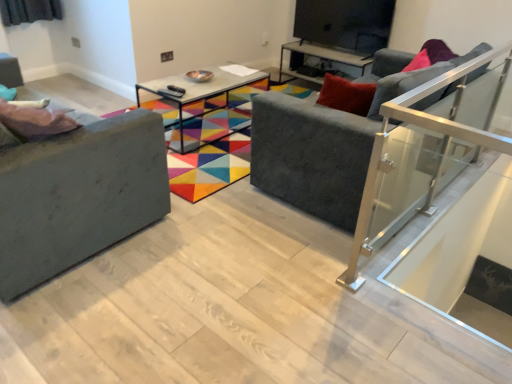
Question: Considering the relative positions of matte gray couch at left, placed as the second studio couch when sorted from right to left, and pink fabric pillow at left in the image provided, is matte gray couch at left, placed as the second studio couch when sorted from right to left, behind pink fabric pillow at left?

Choices:
 (A) yes
 (B) no

Answer: (B)

Question: Could you tell me if matte gray couch at left, placed as the second studio couch when sorted from right to left, is facing pink fabric pillow at left?

Choices:
 (A) no
 (B) yes

Answer: (B)

Question: Is pink fabric pillow at left completely or partially inside matte gray couch at left, the 1th studio couch viewed from the left?

Choices:
 (A) yes
 (B) no

Answer: (A)

Question: Is matte gray couch at left, placed as the second studio couch when sorted from right to left, outside pink fabric pillow at left?

Choices:
 (A) yes
 (B) no

Answer: (A)

Question: Is matte gray couch at left, the 1th studio couch viewed from the left, closer to the viewer compared to pink fabric pillow at left?

Choices:
 (A) no
 (B) yes

Answer: (B)

Question: Based on their sizes in the image, would you say metallic glass table at center, arranged as the 2th table when viewed from the right, is bigger or smaller than matte black tv stand at upper center?

Choices:
 (A) small
 (B) big

Answer: (B)

Question: Considering their positions, is metallic glass table at center, which is the 1th table from left to right, located in front of or behind matte black tv stand at upper center?

Choices:
 (A) front
 (B) behind

Answer: (A)

Question: Is metallic glass table at center, arranged as the 2th table when viewed from the right, taller or shorter than matte black tv stand at upper center?

Choices:
 (A) tall
 (B) short

Answer: (B)

Question: Visually, is metallic glass table at center, arranged as the first table when viewed from the front, positioned to the left or to the right of matte black tv stand at upper center?

Choices:
 (A) left
 (B) right

Answer: (A)

Question: Is metallic glass table at center, placed as the second table when sorted from back to front, taller or shorter than velvet grey couch at center, the 1th studio couch from the right?

Choices:
 (A) short
 (B) tall

Answer: (A)

Question: Looking at their shapes, would you say metallic glass table at center, arranged as the 2th table when viewed from the right, is wider or thinner than velvet grey couch at center, the 1th studio couch from the right?

Choices:
 (A) thin
 (B) wide

Answer: (A)

Question: From the image's perspective, is metallic glass table at center, which is the 1th table from left to right, positioned above or below velvet grey couch at center, the 2th studio couch in the left-to-right sequence?

Choices:
 (A) below
 (B) above

Answer: (B)

Question: From a real-world perspective, is metallic glass table at center, arranged as the first table when viewed from the front, physically located above or below velvet grey couch at center, the 1th studio couch from the right?

Choices:
 (A) above
 (B) below

Answer: (B)

Question: Considering the positions of matte gray couch at left, the 1th studio couch viewed from the left, and metallic glass table at center, placed as the second table when sorted from back to front, in the image, is matte gray couch at left, the 1th studio couch viewed from the left, wider or thinner than metallic glass table at center, placed as the second table when sorted from back to front,?

Choices:
 (A) wide
 (B) thin

Answer: (B)

Question: From a real-world perspective, relative to metallic glass table at center, arranged as the first table when viewed from the front, is matte gray couch at left, placed as the second studio couch when sorted from right to left, vertically above or below?

Choices:
 (A) above
 (B) below

Answer: (A)